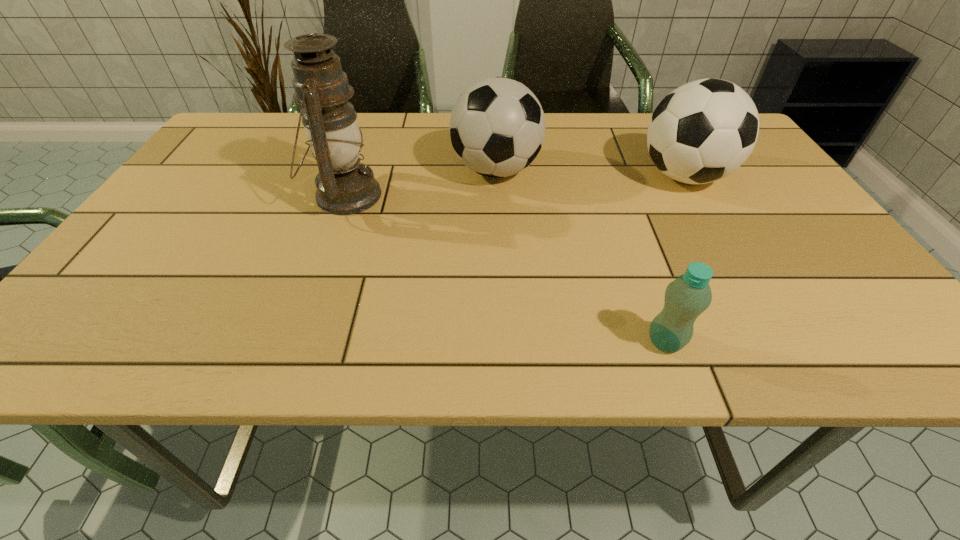
Where is `vacant space at the near right corner of the desktop`? The height and width of the screenshot is (540, 960). vacant space at the near right corner of the desktop is located at coordinates (871, 360).

Find the location of a particular element. Image resolution: width=960 pixels, height=540 pixels. vacant area that lies between the second object from left to right and the nearest object is located at coordinates coord(581,256).

Where is `vacant point located between the shortest object and the right soccer ball`? The width and height of the screenshot is (960, 540). vacant point located between the shortest object and the right soccer ball is located at coordinates (675, 259).

In order to click on free space that is in between the leftmost object and the water bottle in this screenshot , I will do `click(505, 268)`.

The width and height of the screenshot is (960, 540). Identify the location of vacant area between the leftmost object and the shortest object. (505, 268).

At what (x,y) coordinates should I click in order to perform the action: click on vacant space that is in between the left soccer ball and the third object from left to right. Please return your answer as a coordinate pair (x, y). Image resolution: width=960 pixels, height=540 pixels. Looking at the image, I should click on (581, 256).

The image size is (960, 540). I want to click on free space between the shortest object and the rightmost object, so click(x=675, y=259).

Locate an element on the screen. This screenshot has height=540, width=960. vacant space in between the right soccer ball and the third object from left to right is located at coordinates (675, 259).

Identify the location of free space that is in between the third object from left to right and the right soccer ball. (675, 259).

Where is `unoccupied position between the shortest object and the right soccer ball`? This screenshot has height=540, width=960. unoccupied position between the shortest object and the right soccer ball is located at coordinates (675, 259).